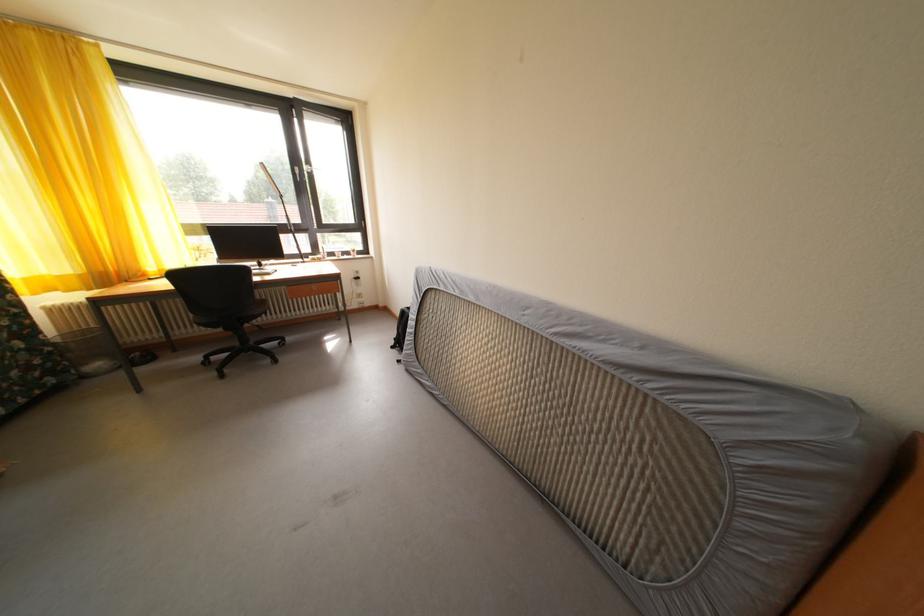
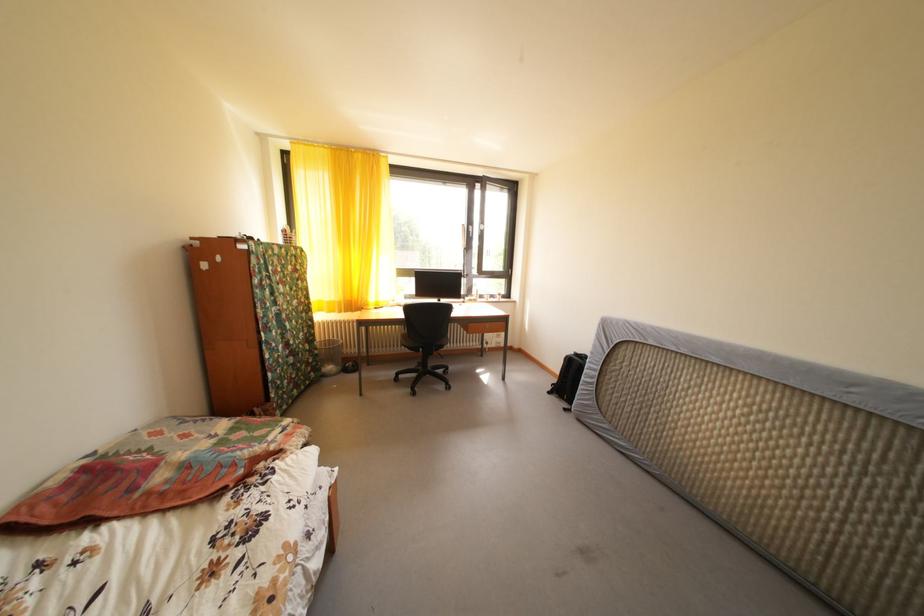
Locate, in the second image, the point that corresponds to pixel 39 355 in the first image.

(320, 357)